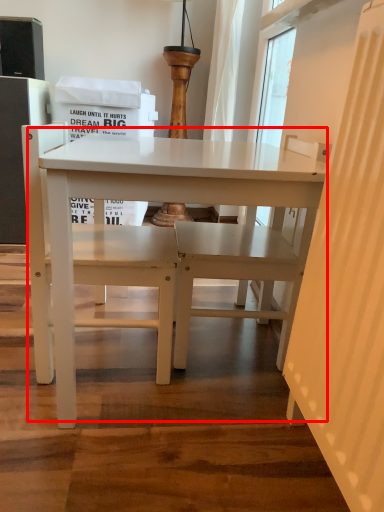
Question: From the image's perspective, what is the correct spatial relationship of table (annotated by the red box) in relation to chair?

Choices:
 (A) above
 (B) below

Answer: (B)